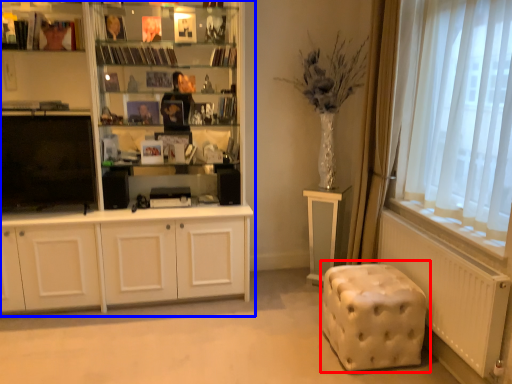
Question: Which point is closer to the camera, music stool (highlighted by a red box) or cupboard (highlighted by a blue box)?

Choices:
 (A) music stool
 (B) cupboard

Answer: (A)